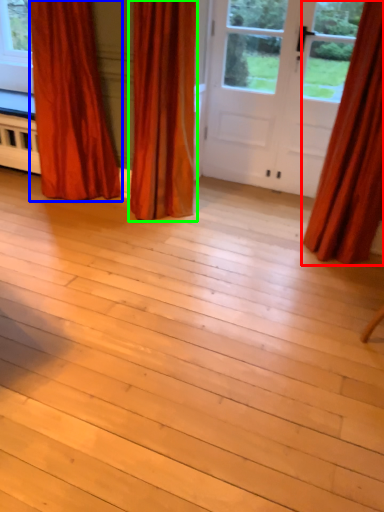
Question: Based on their relative distances, which object is farther from curtain (highlighted by a red box)? Choose from curtain (highlighted by a blue box) and curtain (highlighted by a green box).

Choices:
 (A) curtain
 (B) curtain

Answer: (A)